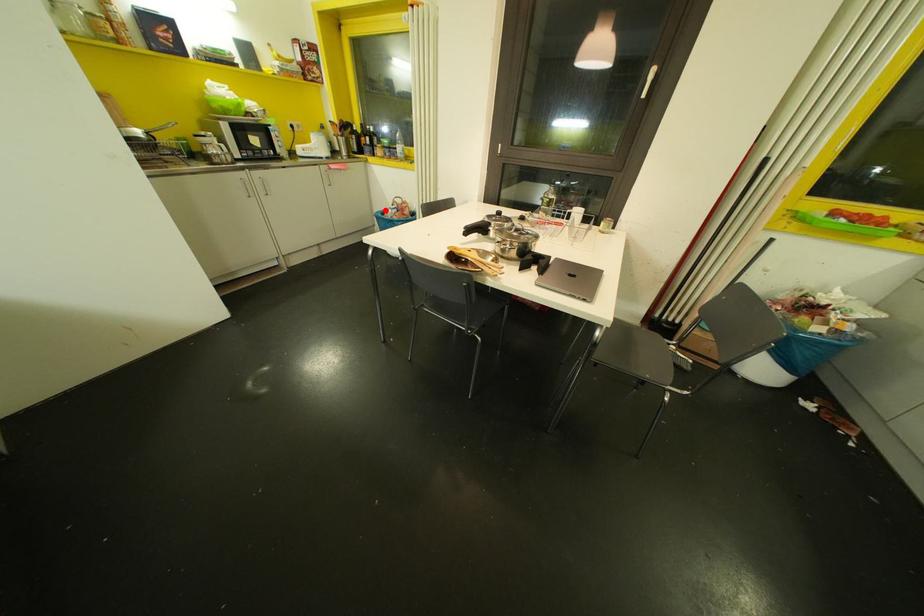
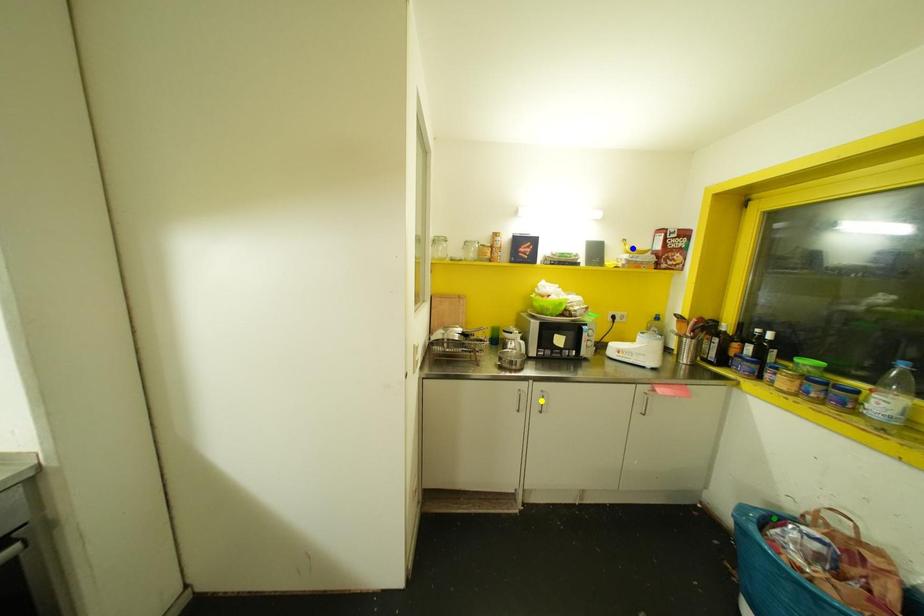
Question: I am providing you with two images of the same scene from different viewpoints. A red point is marked on the first image. You are given multiple points on the second image. Which point in image 2 is actually the same real-world point as the red point in image 1?

Choices:
 (A) green point
 (B) yellow point
 (C) blue point

Answer: (A)